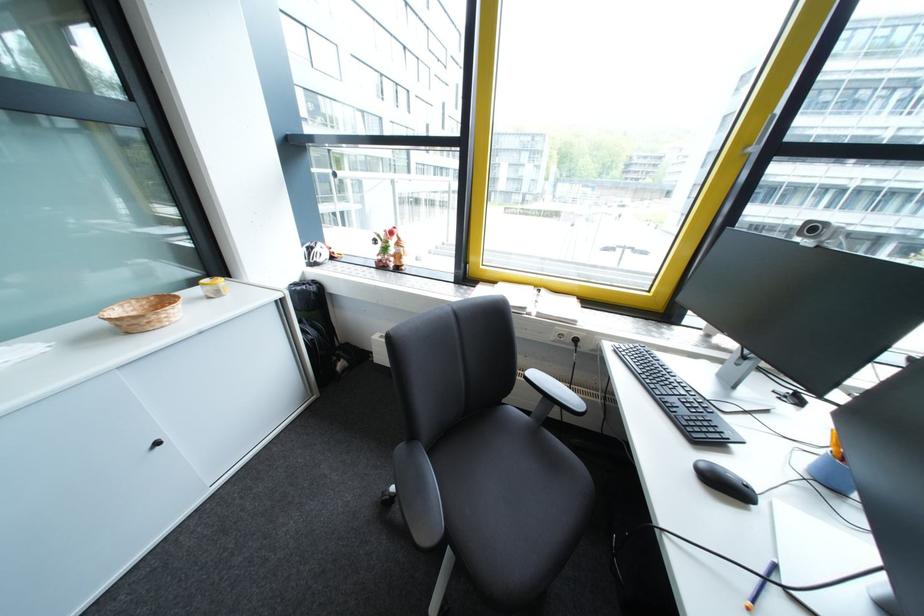
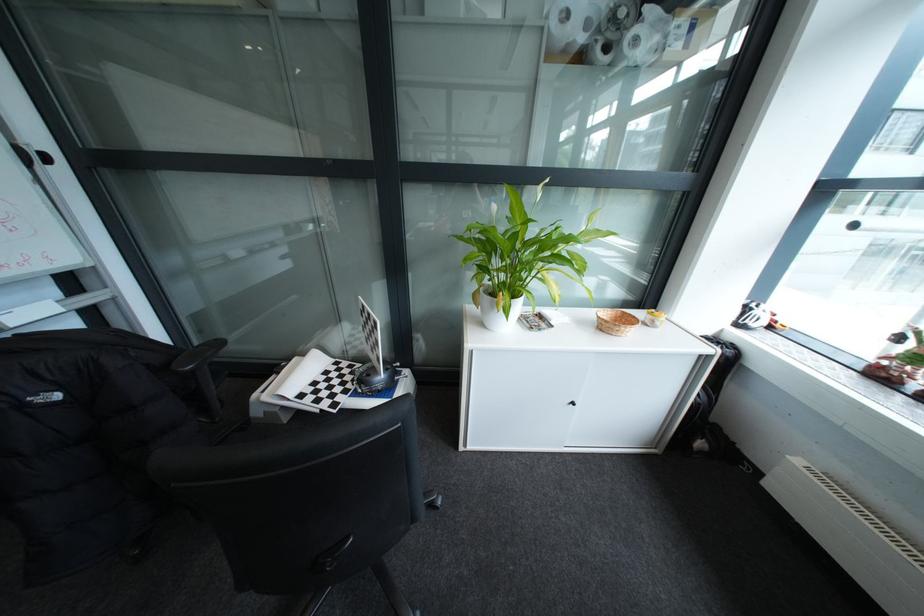
Where in the second image is the point corresponding to point (141, 334) from the first image?

(614, 331)